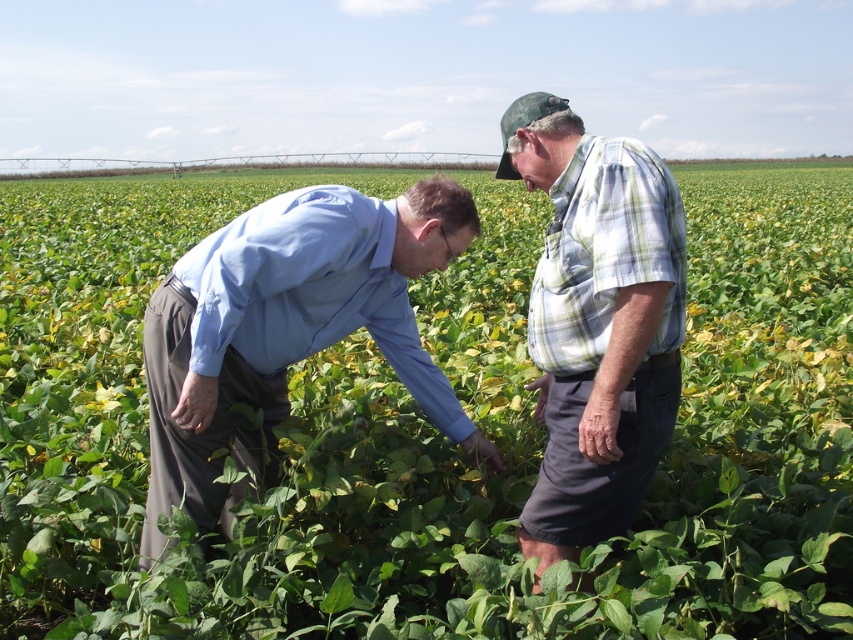
Does light blue shirt at center have a lesser width compared to plaid shirt at center?

No, light blue shirt at center is not thinner than plaid shirt at center.

Is light blue shirt at center bigger than plaid shirt at center?

Actually, light blue shirt at center might be smaller than plaid shirt at center.

Which is in front, point (192, 388) or point (595, 408)?

Point (595, 408) is more forward.

Locate an element on the screen. light blue shirt at center is located at coordinates (288, 330).